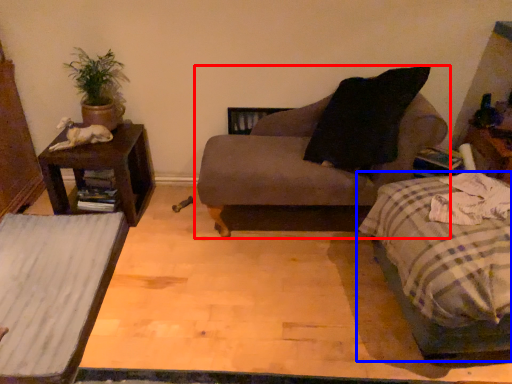
Question: Which object appears closest to the camera in this image, chair (highlighted by a red box) or bed (highlighted by a blue box)?

Choices:
 (A) chair
 (B) bed

Answer: (B)